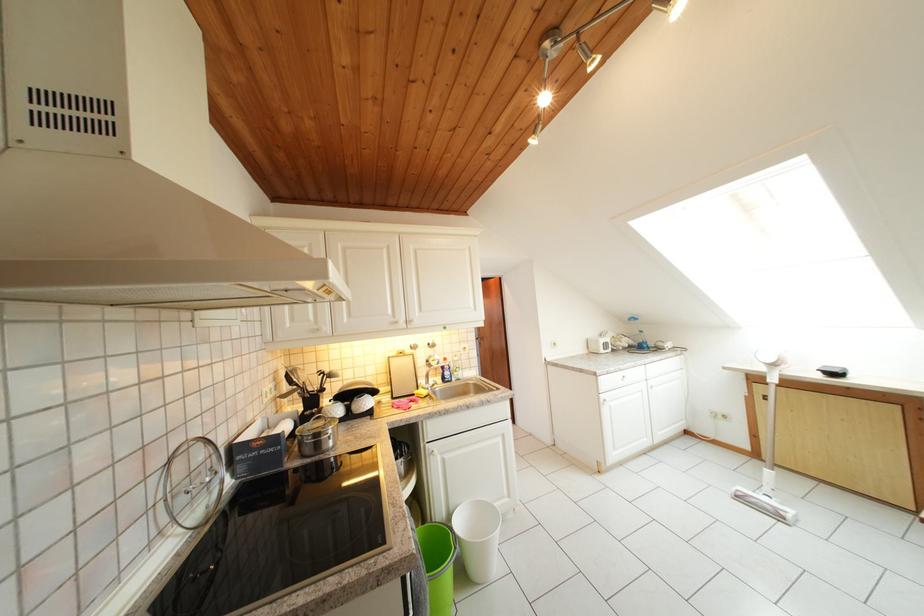
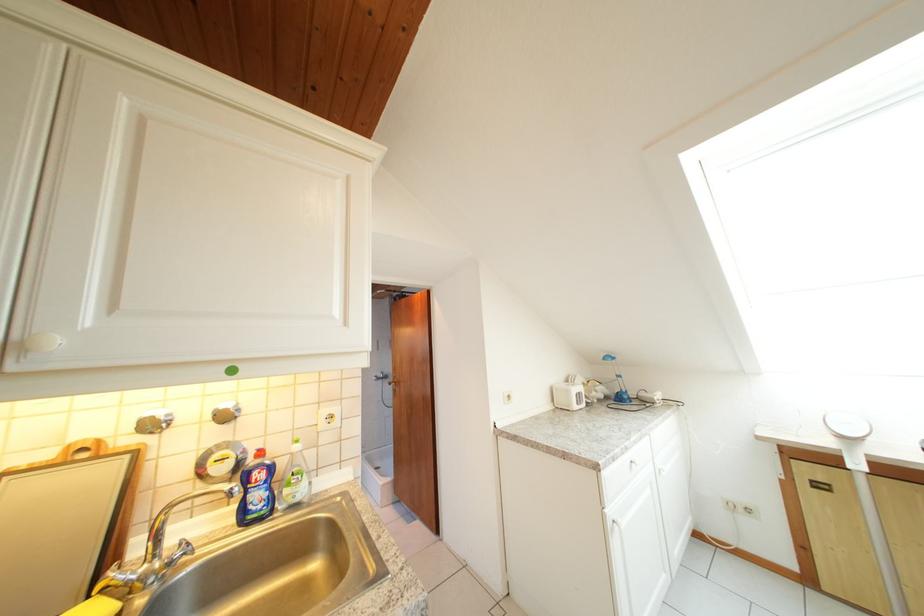
Locate, in the second image, the point that corresponds to point 767,402 in the first image.

(810, 487)